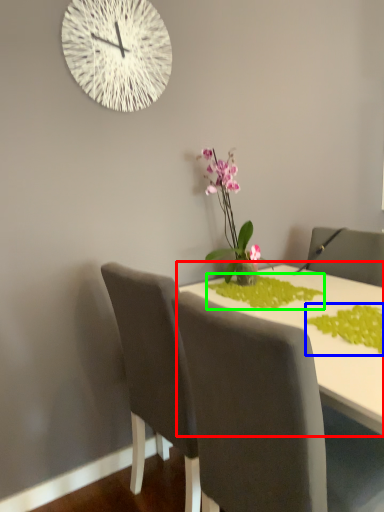
Question: Considering the real-world distances, which object is closest to table (highlighted by a red box)? plant (highlighted by a blue box) or plant (highlighted by a green box).

Choices:
 (A) plant
 (B) plant

Answer: (B)